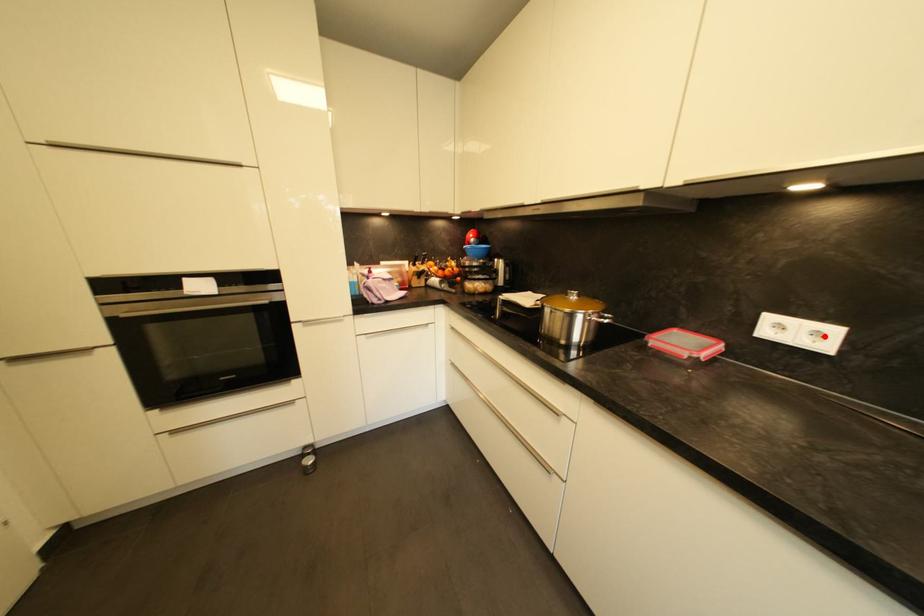
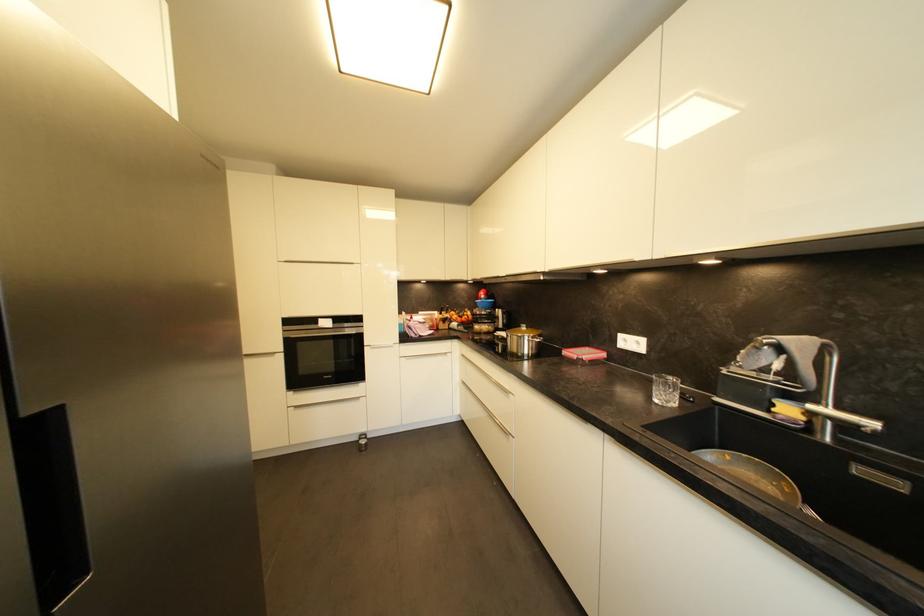
The point at the highlighted location is marked in the first image. Where is the corresponding point in the second image?

(642, 345)